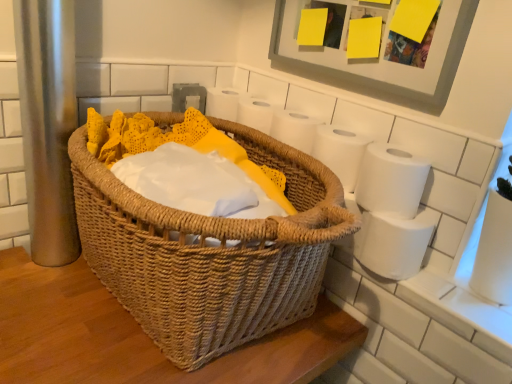
At what (x,y) coordinates should I click in order to perform the action: click on woven brown picnic basket at center. Please return your answer as a coordinate pair (x, y). This screenshot has height=384, width=512. Looking at the image, I should click on (210, 252).

I want to click on white matte toilet paper at upper right, arranged as the first toilet paper when viewed from the top, so click(340, 152).

This screenshot has width=512, height=384. Identify the location of white matte toilet paper at right, placed as the first toilet paper when sorted from bottom to top. (392, 243).

Which of these two, matte gray picture frame at upper right or white matte toilet paper at right, which is counted as the second toilet paper, starting from the bottom, stands taller?

matte gray picture frame at upper right is taller.

Could you tell me if matte gray picture frame at upper right is turned towards white matte toilet paper at right, which is counted as the second toilet paper, starting from the bottom?

No, matte gray picture frame at upper right is not oriented towards white matte toilet paper at right, which is counted as the second toilet paper, starting from the bottom.

Considering the relative sizes of matte gray picture frame at upper right and white matte toilet paper at right, which is counted as the second toilet paper, starting from the bottom, in the image provided, is matte gray picture frame at upper right bigger than white matte toilet paper at right, which is counted as the second toilet paper, starting from the bottom,?

Yes, matte gray picture frame at upper right is bigger than white matte toilet paper at right, which is counted as the second toilet paper, starting from the bottom.

Between matte gray picture frame at upper right and white matte toilet paper at right, which is counted as the second toilet paper, starting from the bottom, which one has smaller width?

matte gray picture frame at upper right.

Does white matte toilet paper at right, acting as the 2th toilet paper starting from the top, have a greater width compared to matte gray picture frame at upper right?

Yes, white matte toilet paper at right, acting as the 2th toilet paper starting from the top, is wider than matte gray picture frame at upper right.

From the image's perspective, which is above, white matte toilet paper at right, acting as the 2th toilet paper starting from the top, or matte gray picture frame at upper right?

From the image's view, matte gray picture frame at upper right is above.

Would you consider white matte toilet paper at right, acting as the 2th toilet paper starting from the top, to be distant from matte gray picture frame at upper right?

No, white matte toilet paper at right, acting as the 2th toilet paper starting from the top, is not far away from matte gray picture frame at upper right.

Is point (407, 167) less distant than point (456, 10)?

No, it is not.

How many degrees apart are the facing directions of white matte toilet paper at right, which is counted as the third toilet paper, starting from the top, and woven brown picnic basket at center?

The angle between the facing direction of white matte toilet paper at right, which is counted as the third toilet paper, starting from the top, and the facing direction of woven brown picnic basket at center is 0.000146 degrees.

Does white matte toilet paper at right, placed as the first toilet paper when sorted from bottom to top, appear on the right side of woven brown picnic basket at center?

Yes.

Does point (417, 221) come farther from viewer compared to point (230, 261)?

Yes.

Is white matte toilet paper at right, which is counted as the third toilet paper, starting from the top, beside woven brown picnic basket at center?

No, white matte toilet paper at right, which is counted as the third toilet paper, starting from the top, is not making contact with woven brown picnic basket at center.

Does white matte toilet paper at upper right, acting as the third toilet paper starting from the bottom, appear on the right side of woven brown picnic basket at center?

Yes, white matte toilet paper at upper right, acting as the third toilet paper starting from the bottom, is to the right of woven brown picnic basket at center.

Between white matte toilet paper at upper right, arranged as the first toilet paper when viewed from the top, and woven brown picnic basket at center, which one has less height?

Standing shorter between the two is white matte toilet paper at upper right, arranged as the first toilet paper when viewed from the top.

Considering the positions of objects white matte toilet paper at upper right, arranged as the first toilet paper when viewed from the top, and woven brown picnic basket at center in the image provided, who is in front, white matte toilet paper at upper right, arranged as the first toilet paper when viewed from the top, or woven brown picnic basket at center?

woven brown picnic basket at center is more forward.

In the scene shown: Considering the sizes of objects white matte toilet paper at upper right, arranged as the first toilet paper when viewed from the top, and woven brown picnic basket at center in the image provided, who is thinner, white matte toilet paper at upper right, arranged as the first toilet paper when viewed from the top, or woven brown picnic basket at center?

Thinner between the two is white matte toilet paper at upper right, arranged as the first toilet paper when viewed from the top.

In the scene shown: From the image's perspective, relative to white matte toilet paper at upper right, acting as the third toilet paper starting from the bottom, is white matte toilet paper at right, which is counted as the second toilet paper, starting from the bottom, above or below?

white matte toilet paper at right, which is counted as the second toilet paper, starting from the bottom, is situated lower than white matte toilet paper at upper right, acting as the third toilet paper starting from the bottom, in the image.

Where is `the 2nd toilet paper in front of the white matte toilet paper at upper right, arranged as the first toilet paper when viewed from the top, starting your count from the anchor`? the 2nd toilet paper in front of the white matte toilet paper at upper right, arranged as the first toilet paper when viewed from the top, starting your count from the anchor is located at coordinates (391, 180).

Are white matte toilet paper at right, which is counted as the second toilet paper, starting from the bottom, and white matte toilet paper at upper right, arranged as the first toilet paper when viewed from the top, far apart?

That's not correct — white matte toilet paper at right, which is counted as the second toilet paper, starting from the bottom, is a little close to white matte toilet paper at upper right, arranged as the first toilet paper when viewed from the top.

From a real-world perspective, does white matte toilet paper at right, acting as the 2th toilet paper starting from the top, stand above white matte toilet paper at upper right, arranged as the first toilet paper when viewed from the top?

Yes, from a real-world perspective, white matte toilet paper at right, acting as the 2th toilet paper starting from the top, is on top of white matte toilet paper at upper right, arranged as the first toilet paper when viewed from the top.

Which object is positioned more to the right, matte gray picture frame at upper right or woven brown picnic basket at center?

From the viewer's perspective, matte gray picture frame at upper right appears more on the right side.

Relative to woven brown picnic basket at center, is matte gray picture frame at upper right in front or behind?

In the image, matte gray picture frame at upper right appears behind woven brown picnic basket at center.

From the image's perspective, is matte gray picture frame at upper right positioned above or below woven brown picnic basket at center?

From the image's perspective, matte gray picture frame at upper right appears above woven brown picnic basket at center.

The height and width of the screenshot is (384, 512). What are the coordinates of `picnic basket located below the matte gray picture frame at upper right (from the image's perspective)` in the screenshot? It's located at (210, 252).

Is white matte toilet paper at right, which is counted as the second toilet paper, starting from the bottom, far away from white matte toilet paper at right, placed as the first toilet paper when sorted from bottom to top?

That's not correct — white matte toilet paper at right, which is counted as the second toilet paper, starting from the bottom, is a little close to white matte toilet paper at right, placed as the first toilet paper when sorted from bottom to top.

Which is correct: white matte toilet paper at right, acting as the 2th toilet paper starting from the top, is inside white matte toilet paper at right, placed as the first toilet paper when sorted from bottom to top, or outside of it?

white matte toilet paper at right, acting as the 2th toilet paper starting from the top, is outside white matte toilet paper at right, placed as the first toilet paper when sorted from bottom to top.

Does white matte toilet paper at right, acting as the 2th toilet paper starting from the top, have a lesser width compared to white matte toilet paper at right, placed as the first toilet paper when sorted from bottom to top?

Indeed, white matte toilet paper at right, acting as the 2th toilet paper starting from the top, has a lesser width compared to white matte toilet paper at right, placed as the first toilet paper when sorted from bottom to top.

Find the location of a particular element. picture frame in front of the white matte toilet paper at right, acting as the 2th toilet paper starting from the top is located at coordinates (374, 48).

Find the location of `toilet paper that is the 1st object located behind the matte gray picture frame at upper right`. toilet paper that is the 1st object located behind the matte gray picture frame at upper right is located at coordinates pyautogui.click(x=391, y=180).

Based on their spatial positions, is woven brown picnic basket at center or white matte toilet paper at right, which is counted as the third toilet paper, starting from the top, closer to white matte toilet paper at upper right, arranged as the first toilet paper when viewed from the top?

The object closer to white matte toilet paper at upper right, arranged as the first toilet paper when viewed from the top, is white matte toilet paper at right, which is counted as the third toilet paper, starting from the top.

From the image, which object appears to be nearer to white matte toilet paper at right, acting as the 2th toilet paper starting from the top, woven brown picnic basket at center or matte gray picture frame at upper right?

matte gray picture frame at upper right is closer to white matte toilet paper at right, acting as the 2th toilet paper starting from the top.

From the image, which object appears to be nearer to white matte toilet paper at right, placed as the first toilet paper when sorted from bottom to top, white matte toilet paper at upper right, acting as the third toilet paper starting from the bottom, or woven brown picnic basket at center?

white matte toilet paper at upper right, acting as the third toilet paper starting from the bottom, is positioned closer to the anchor white matte toilet paper at right, placed as the first toilet paper when sorted from bottom to top.

Based on their spatial positions, is white matte toilet paper at right, placed as the first toilet paper when sorted from bottom to top, or white matte toilet paper at right, which is counted as the second toilet paper, starting from the bottom, closer to matte gray picture frame at upper right?

white matte toilet paper at right, which is counted as the second toilet paper, starting from the bottom, is positioned closer to the anchor matte gray picture frame at upper right.

From the image, which object appears to be nearer to white matte toilet paper at right, which is counted as the third toilet paper, starting from the top, white matte toilet paper at upper right, arranged as the first toilet paper when viewed from the top, or white matte toilet paper at right, acting as the 2th toilet paper starting from the top?

Based on the image, white matte toilet paper at right, acting as the 2th toilet paper starting from the top, appears to be nearer to white matte toilet paper at right, which is counted as the third toilet paper, starting from the top.

When comparing their distances from white matte toilet paper at right, acting as the 2th toilet paper starting from the top, does matte gray picture frame at upper right or white matte toilet paper at right, placed as the first toilet paper when sorted from bottom to top, seem further?

matte gray picture frame at upper right lies further to white matte toilet paper at right, acting as the 2th toilet paper starting from the top, than the other object.

Based on their spatial positions, is matte gray picture frame at upper right or woven brown picnic basket at center further from white matte toilet paper at right, placed as the first toilet paper when sorted from bottom to top?

matte gray picture frame at upper right is further to white matte toilet paper at right, placed as the first toilet paper when sorted from bottom to top.

Based on their spatial positions, is white matte toilet paper at upper right, acting as the third toilet paper starting from the bottom, or white matte toilet paper at right, acting as the 2th toilet paper starting from the top, closer to matte gray picture frame at upper right?

Based on the image, white matte toilet paper at upper right, acting as the third toilet paper starting from the bottom, appears to be nearer to matte gray picture frame at upper right.

Where is `picnic basket between matte gray picture frame at upper right and white matte toilet paper at right, placed as the first toilet paper when sorted from bottom to top, from top to bottom`? picnic basket between matte gray picture frame at upper right and white matte toilet paper at right, placed as the first toilet paper when sorted from bottom to top, from top to bottom is located at coordinates (210, 252).

Identify the location of toilet paper that lies between white matte toilet paper at upper right, arranged as the first toilet paper when viewed from the top, and white matte toilet paper at right, which is counted as the third toilet paper, starting from the top, from top to bottom. The width and height of the screenshot is (512, 384). (391, 180).

This screenshot has width=512, height=384. Identify the location of toilet paper between matte gray picture frame at upper right and white matte toilet paper at right, acting as the 2th toilet paper starting from the top, from top to bottom. (340, 152).

Locate an element on the screen. This screenshot has height=384, width=512. picture frame between woven brown picnic basket at center and white matte toilet paper at upper right, acting as the third toilet paper starting from the bottom, along the z-axis is located at coordinates (374, 48).